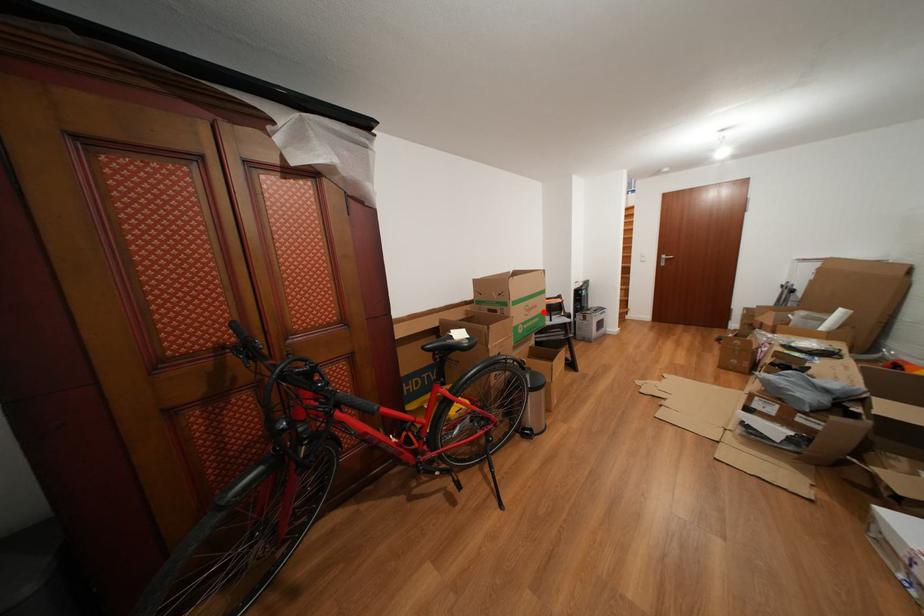
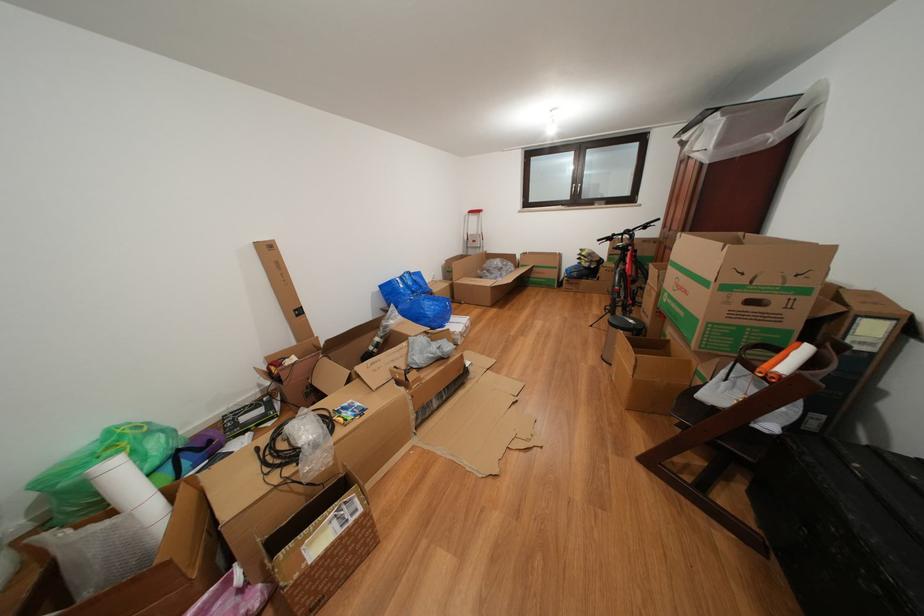
Question: I am providing you with two images of the same scene from different viewpoints. Image1 has a red point marked. In image2, the corresponding 3D location appears at what relative position? Reply with the corresponding letter.

Choices:
 (A) Closer
 (B) Farther

Answer: (A)